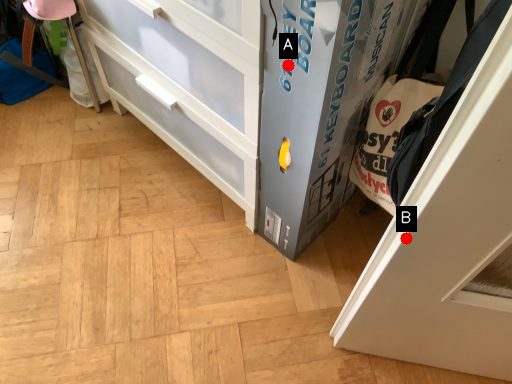
Question: Two points are circled on the image, labeled by A and B beside each circle. Which point is farther to the camera?

Choices:
 (A) A is further
 (B) B is further

Answer: (A)